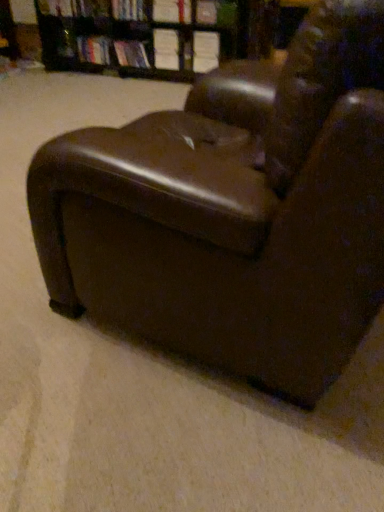
Measure the distance between brown leather bookcase at upper center and camera.

They are 3.05 meters apart.

Based on the photo, measure the distance between point (206, 12) and camera.

Point (206, 12) is 3.25 meters from camera.

You are a GUI agent. You are given a task and a screenshot of the screen. Output one action in this format:
    pyautogui.click(x=<x>, y=<y>)
    Task: Click on the hardcover book at upper center, the third book in the left-to-right sequence
    Image resolution: width=384 pixels, height=512 pixels.
    Given the screenshot: What is the action you would take?
    pyautogui.click(x=130, y=10)

This screenshot has height=512, width=384. In order to click on brown leather bookcase at upper center in this screenshot , I will do coord(116,41).

What's the angular difference between hardcover book at upper center, which ranks as the second book in left-to-right order, and hardcover book at upper center, the sixth book when ordered from right to left,'s facing directions?

The angular difference between hardcover book at upper center, which ranks as the second book in left-to-right order, and hardcover book at upper center, the sixth book when ordered from right to left, is 0.0005 degrees.

Looking at this image, is hardcover book at upper center, which ranks as the second book in left-to-right order, wider or thinner than hardcover book at upper center, which is the 1th book from left to right?

In the image, hardcover book at upper center, which ranks as the second book in left-to-right order, appears to be more narrow than hardcover book at upper center, which is the 1th book from left to right.

Which object is more forward, hardcover book at upper center, which ranks as the second book in left-to-right order, or hardcover book at upper center, which is the 1th book from left to right?

hardcover book at upper center, which ranks as the second book in left-to-right order.

This screenshot has width=384, height=512. Identify the location of the 2nd book positioned above the hardcover book at upper center, which ranks as the second book in left-to-right order (from the image's perspective). (94, 50).

Can you confirm if brown leather bookcase at upper center is positioned to the left of hardcover book at upper center, the sixth book when ordered from right to left?

No, brown leather bookcase at upper center is not to the left of hardcover book at upper center, the sixth book when ordered from right to left.

Considering the relative sizes of brown leather bookcase at upper center and hardcover book at upper center, the sixth book when ordered from right to left, in the image provided, is brown leather bookcase at upper center thinner than hardcover book at upper center, the sixth book when ordered from right to left,?

No.

Is brown leather bookcase at upper center oriented towards hardcover book at upper center, the sixth book when ordered from right to left?

Yes, brown leather bookcase at upper center is oriented towards hardcover book at upper center, the sixth book when ordered from right to left.

From the image's perspective, which one is positioned lower, brown leather bookcase at upper center or hardcover book at upper center, the sixth book when ordered from right to left?

hardcover book at upper center, the sixth book when ordered from right to left.

From a real-world perspective, which is physically above, brown leather bookcase at upper center or white paper book at upper center, the fourth book from the left?

In real-world perspective, white paper book at upper center, the fourth book from the left, is above.

Does brown leather bookcase at upper center have a greater height compared to white paper book at upper center, arranged as the third book when viewed from the right?

Indeed, brown leather bookcase at upper center has a greater height compared to white paper book at upper center, arranged as the third book when viewed from the right.

Does brown leather bookcase at upper center appear on the left side of white paper book at upper center, the fourth book from the left?

Correct, you'll find brown leather bookcase at upper center to the left of white paper book at upper center, the fourth book from the left.

Does point (141, 13) lie in front of point (231, 13)?

No, (141, 13) is further to viewer.

Locate an element on the screen. Image resolution: width=384 pixels, height=512 pixels. the 3rd book counting from the right side of the hardcover book at upper center, the third book in the left-to-right sequence is located at coordinates (216, 13).

Which of these two, hardcover book at upper center, the third book in the left-to-right sequence, or hardcover book at center, arranged as the first book when viewed from the right, is wider?

With larger width is hardcover book at upper center, the third book in the left-to-right sequence.

From the image's perspective, is hardcover book at upper center, the third book in the left-to-right sequence, on hardcover book at center, positioned as the 6th book in left-to-right order?

Yes.

Is white paper book at upper center, arranged as the third book when viewed from the right, outside of hardcover book at upper center, which ranks as the second book in left-to-right order?

Absolutely, white paper book at upper center, arranged as the third book when viewed from the right, is external to hardcover book at upper center, which ranks as the second book in left-to-right order.

Measure the distance from white paper book at upper center, the fourth book from the left, to hardcover book at upper center, which ranks as the second book in left-to-right order.

A distance of 9.08 inches exists between white paper book at upper center, the fourth book from the left, and hardcover book at upper center, which ranks as the second book in left-to-right order.

Is point (154, 29) closer or farther from the camera than point (125, 55)?

Point (154, 29).

Would you say white paper book at upper center, the fourth book from the left, is to the left or to the right of hardcover book at upper center, which ranks as the second book in left-to-right order, in the picture?

From the image, it's evident that white paper book at upper center, the fourth book from the left, is to the right of hardcover book at upper center, which ranks as the second book in left-to-right order.

From a real-world perspective, relative to white paper book at upper center, arranged as the third book when viewed from the right, is hardcover book at upper center, placed as the fourth book when sorted from right to left, vertically above or below?

hardcover book at upper center, placed as the fourth book when sorted from right to left, is situated higher than white paper book at upper center, arranged as the third book when viewed from the right, in the real world.

Which of these two, hardcover book at upper center, the third book in the left-to-right sequence, or white paper book at upper center, the fourth book from the left, is smaller?

white paper book at upper center, the fourth book from the left.

There is a white paper book at upper center, the fourth book from the left. Where is `the 4th book above it (from the image's perspective)`? The width and height of the screenshot is (384, 512). the 4th book above it (from the image's perspective) is located at coordinates (130, 10).

Is hardcover book at upper center, the third book in the left-to-right sequence, oriented away from white paper book at upper center, arranged as the third book when viewed from the right?

No, hardcover book at upper center, the third book in the left-to-right sequence, is not facing the opposite direction of white paper book at upper center, arranged as the third book when viewed from the right.

Does hardcover book at upper center, the sixth book when ordered from right to left, lie behind white paper book at upper center, which ranks as the 2th book in right-to-left order?

Yes.

Based on the photo, which point is more distant from viewer, (100, 47) or (171, 0)?

The point (100, 47) is farther.

Could you tell me if hardcover book at upper center, the sixth book when ordered from right to left, is turned towards white paper book at upper center, which ranks as the 5th book in left-to-right order?

No, hardcover book at upper center, the sixth book when ordered from right to left, is not aimed at white paper book at upper center, which ranks as the 5th book in left-to-right order.

From the image's perspective, is hardcover book at upper center, which is the 1th book from left to right, above or below white paper book at upper center, which ranks as the 2th book in right-to-left order?

Clearly, from the image's perspective, hardcover book at upper center, which is the 1th book from left to right, is below white paper book at upper center, which ranks as the 2th book in right-to-left order.

The image size is (384, 512). I want to click on the 1st book in front of the hardcover book at upper center, which is the 1th book from left to right, so click(x=131, y=54).

I want to click on book that is the 1st object directly below the brown leather bookcase at upper center (from a real-world perspective), so click(x=94, y=50).

Considering their positions, is hardcover book at center, arranged as the first book when viewed from the right, positioned closer to hardcover book at upper center, which ranks as the second book in left-to-right order, than hardcover book at upper center, the third book in the left-to-right sequence?

hardcover book at upper center, the third book in the left-to-right sequence, is closer to hardcover book at upper center, which ranks as the second book in left-to-right order.

When comparing their distances from brown leather bookcase at upper center, does hardcover book at center, positioned as the 6th book in left-to-right order, or hardcover book at upper center, the sixth book when ordered from right to left, seem closer?

Based on the image, hardcover book at upper center, the sixth book when ordered from right to left, appears to be nearer to brown leather bookcase at upper center.

Which object lies nearer to the anchor point hardcover book at upper center, placed as the fourth book when sorted from right to left, white paper book at upper center, arranged as the third book when viewed from the right, or hardcover book at center, positioned as the 6th book in left-to-right order?

white paper book at upper center, arranged as the third book when viewed from the right, lies closer to hardcover book at upper center, placed as the fourth book when sorted from right to left, than the other object.

From the image, which object appears to be farther from white paper book at upper center, which ranks as the 2th book in right-to-left order, hardcover book at upper center, which is the 1th book from left to right, or white paper book at upper center, the fourth book from the left?

hardcover book at upper center, which is the 1th book from left to right.

Which object lies further to the anchor point hardcover book at upper center, the sixth book when ordered from right to left, brown leather armchair at center or white paper book at upper center, which ranks as the 2th book in right-to-left order?

brown leather armchair at center.

Considering their positions, is hardcover book at upper center, which appears as the fifth book when viewed from the right, positioned closer to brown leather armchair at center than hardcover book at upper center, the third book in the left-to-right sequence?

hardcover book at upper center, which appears as the fifth book when viewed from the right, lies closer to brown leather armchair at center than the other object.

Based on their spatial positions, is hardcover book at center, arranged as the first book when viewed from the right, or brown leather bookcase at upper center further from white paper book at upper center, the fourth book from the left?

hardcover book at center, arranged as the first book when viewed from the right, is further to white paper book at upper center, the fourth book from the left.

Which object lies nearer to the anchor point brown leather armchair at center, white paper book at upper center, the fourth book from the left, or brown leather bookcase at upper center?

brown leather bookcase at upper center is closer to brown leather armchair at center.

At what (x,y) coordinates should I click in order to perform the action: click on bookcase between brown leather armchair at center and white paper book at upper center, arranged as the third book when viewed from the right, from front to back. Please return your answer as a coordinate pair (x, y). The image size is (384, 512). Looking at the image, I should click on (116, 41).

Locate an element on the screen. book between hardcover book at upper center, which is the 1th book from left to right, and hardcover book at upper center, placed as the fourth book when sorted from right to left, in the horizontal direction is located at coordinates coord(131,54).

Find the location of a particular element. The width and height of the screenshot is (384, 512). bookcase positioned between brown leather armchair at center and hardcover book at upper center, placed as the fourth book when sorted from right to left, from near to far is located at coordinates (116, 41).

You are a GUI agent. You are given a task and a screenshot of the screen. Output one action in this format:
    pyautogui.click(x=<x>, y=<y>)
    Task: Click on the book between white paper book at upper center, the fourth book from the left, and hardcover book at center, positioned as the 6th book in left-to-right order, in the horizontal direction
    This screenshot has height=512, width=384.
    Given the screenshot: What is the action you would take?
    pyautogui.click(x=172, y=11)